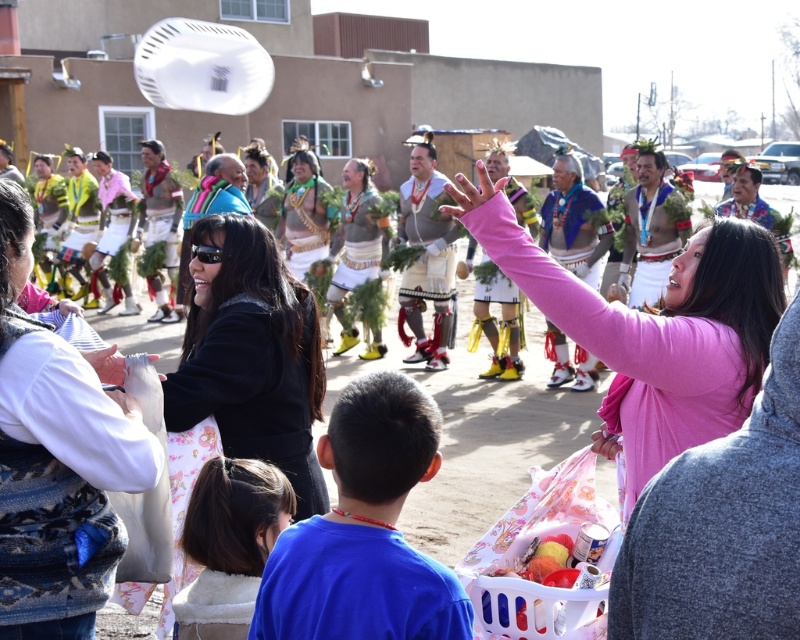
Who is shorter, pink matte shirt at upper right or matte white headdress at center?

Standing shorter between the two is pink matte shirt at upper right.

Can you confirm if pink matte shirt at upper right is positioned to the right of matte white headdress at center?

Correct, you'll find pink matte shirt at upper right to the right of matte white headdress at center.

Locate an element on the screen. This screenshot has height=640, width=800. pink matte shirt at upper right is located at coordinates (721, 525).

Identify the location of pink matte shirt at upper right. (721, 525).

What do you see at coordinates (252, 356) in the screenshot? This screenshot has width=800, height=640. I see `black matte jacket at center` at bounding box center [252, 356].

Can you confirm if black matte jacket at center is smaller than white fluffy blanket at lower left?

No.

Image resolution: width=800 pixels, height=640 pixels. In order to click on black matte jacket at center in this screenshot , I will do `click(252, 356)`.

Image resolution: width=800 pixels, height=640 pixels. I want to click on black matte jacket at center, so click(252, 356).

Is blue fabric shirt at lower center above matte white headdress at center?

No, blue fabric shirt at lower center is not above matte white headdress at center.

This screenshot has height=640, width=800. In order to click on blue fabric shirt at lower center in this screenshot , I will do `click(356, 588)`.